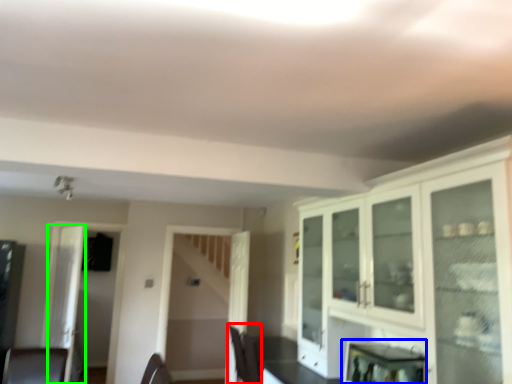
Question: Estimate the real-world distances between objects in this image. Which object is farther from chair (highlighted by a red box), appliance (highlighted by a blue box) or glass door (highlighted by a green box)?

Choices:
 (A) appliance
 (B) glass door

Answer: (B)